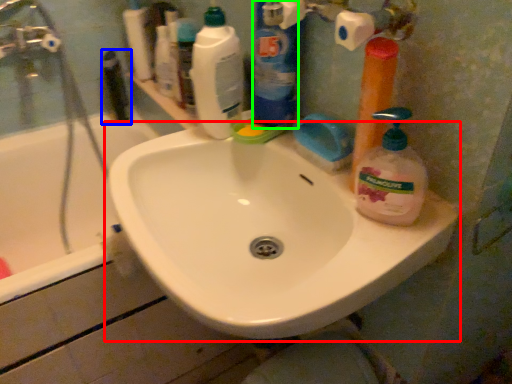
Question: Which is farther away from sink (highlighted by a red box)? toiletry (highlighted by a blue box) or cleaning product (highlighted by a green box)?

Choices:
 (A) toiletry
 (B) cleaning product

Answer: (A)